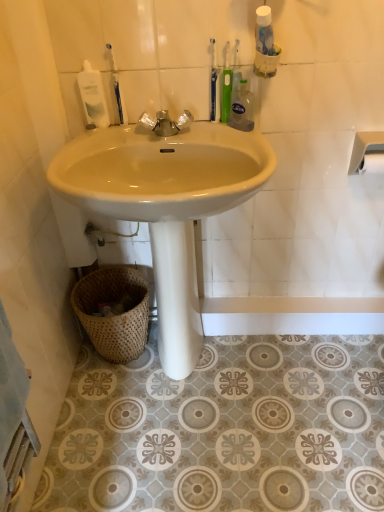
What are the coordinates of `vacant area that lies between matte silver faucet at center and blue plastic toothbrush at upper center, the third toothbrush from the right` in the screenshot? It's located at (198, 130).